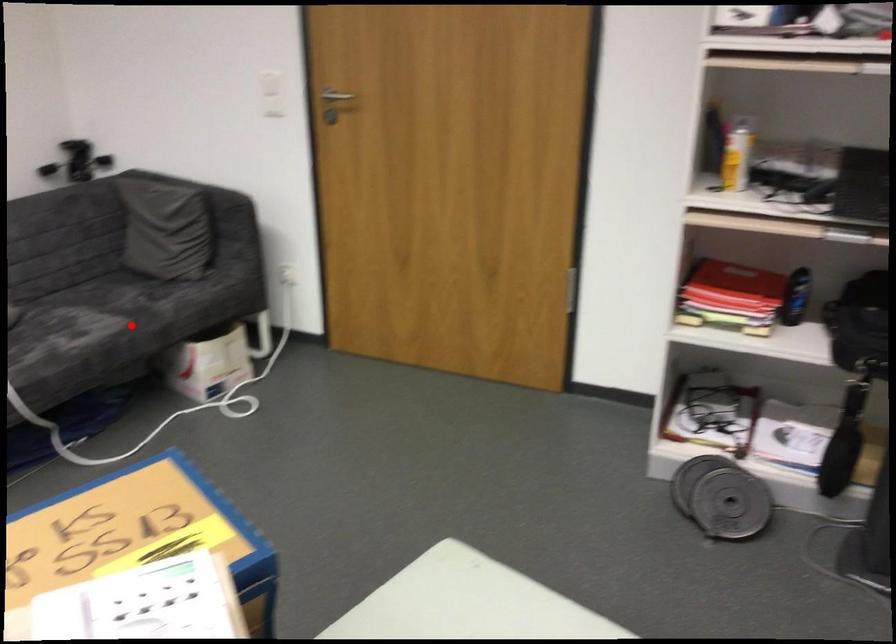
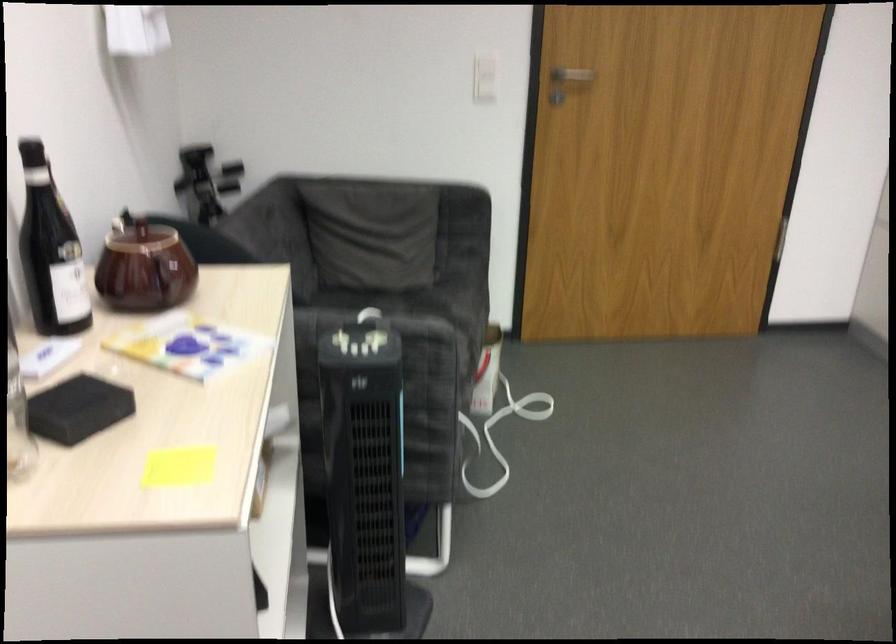
In the second image, find the point that corresponds to the highlighted location in the first image.

(460, 335)